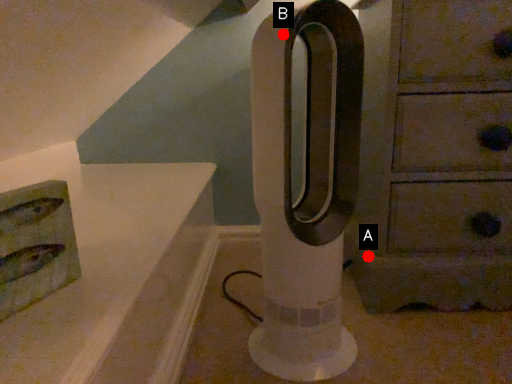
Question: Two points are circled on the image, labeled by A and B beside each circle. Which point is farther to the camera?

Choices:
 (A) A is further
 (B) B is further

Answer: (A)